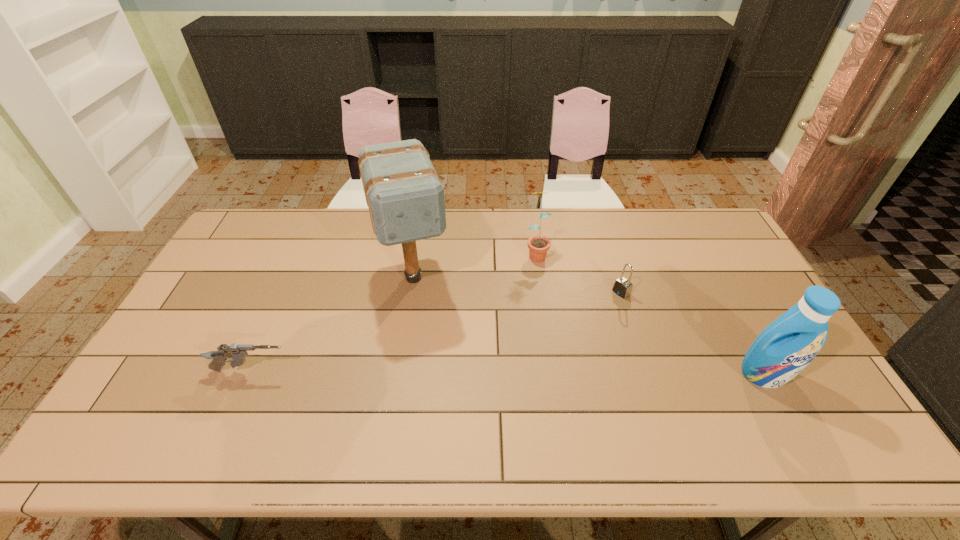
This screenshot has width=960, height=540. I want to click on mallet located at the far edge, so [405, 196].

Find the location of a particular element. object situated at the near edge is located at coordinates (784, 348).

You are a GUI agent. You are given a task and a screenshot of the screen. Output one action in this format:
    pyautogui.click(x=<x>, y=<y>)
    Task: Click on the object at the right edge
    The image size is (960, 540).
    Given the screenshot: What is the action you would take?
    pyautogui.click(x=784, y=348)

You are a GUI agent. You are given a task and a screenshot of the screen. Output one action in this format:
    pyautogui.click(x=<x>, y=<y>)
    Task: Click on the object present at the near right corner
    
    Given the screenshot: What is the action you would take?
    pyautogui.click(x=784, y=348)

Where is `vacant point at the far edge`? This screenshot has height=540, width=960. vacant point at the far edge is located at coordinates (368, 234).

At what (x,y) coordinates should I click in order to perform the action: click on vacant space at the near edge. Please return your answer as a coordinate pair (x, y). Looking at the image, I should click on (224, 386).

Locate an element on the screen. This screenshot has width=960, height=540. vacant space at the left edge of the desktop is located at coordinates (212, 281).

Where is `vacant space at the right edge of the desktop`? vacant space at the right edge of the desktop is located at coordinates (736, 316).

This screenshot has width=960, height=540. In order to click on vacant point at the far left corner in this screenshot , I will do `click(279, 215)`.

In order to click on free spot between the leftmost object and the detergent in this screenshot , I will do coord(508,373).